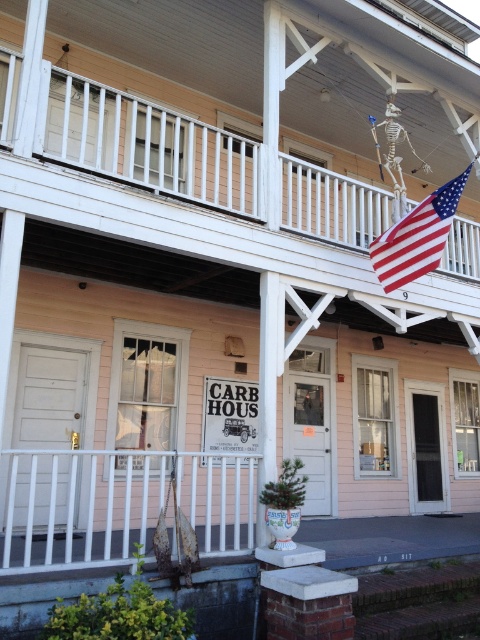
Question: Among these points, which one is nearest to the camera?

Choices:
 (A) pyautogui.click(x=444, y=205)
 (B) pyautogui.click(x=250, y=540)

Answer: (B)

Question: Does white metal rail at lower left appear on the right side of american flag at upper right?

Choices:
 (A) no
 (B) yes

Answer: (A)

Question: Considering the relative positions of white metal rail at lower left and american flag at upper right in the image provided, where is white metal rail at lower left located with respect to american flag at upper right?

Choices:
 (A) below
 (B) above

Answer: (A)

Question: Which point is closer to the camera taking this photo?

Choices:
 (A) (60, 547)
 (B) (434, 211)

Answer: (A)

Question: Does white metal rail at lower left appear under american flag at upper right?

Choices:
 (A) no
 (B) yes

Answer: (B)